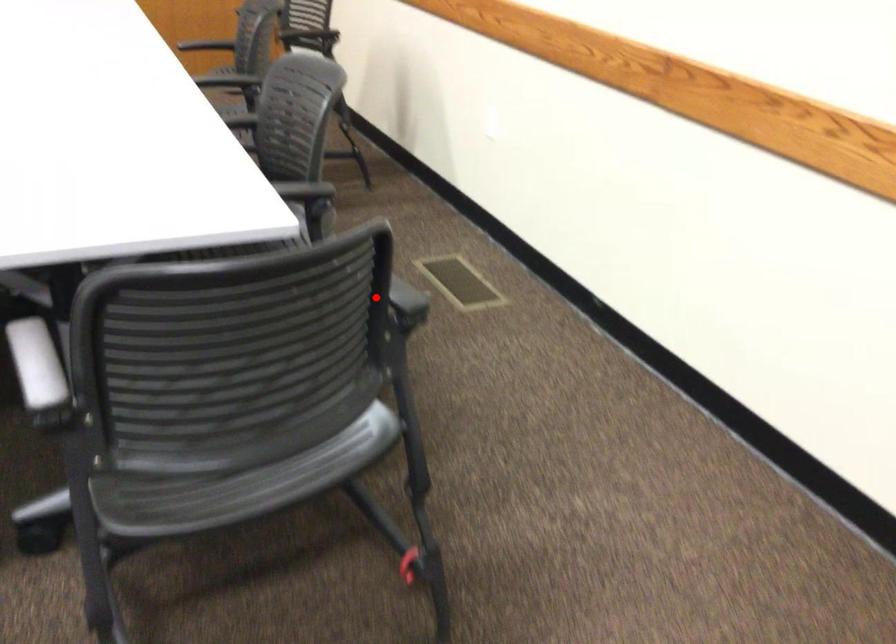
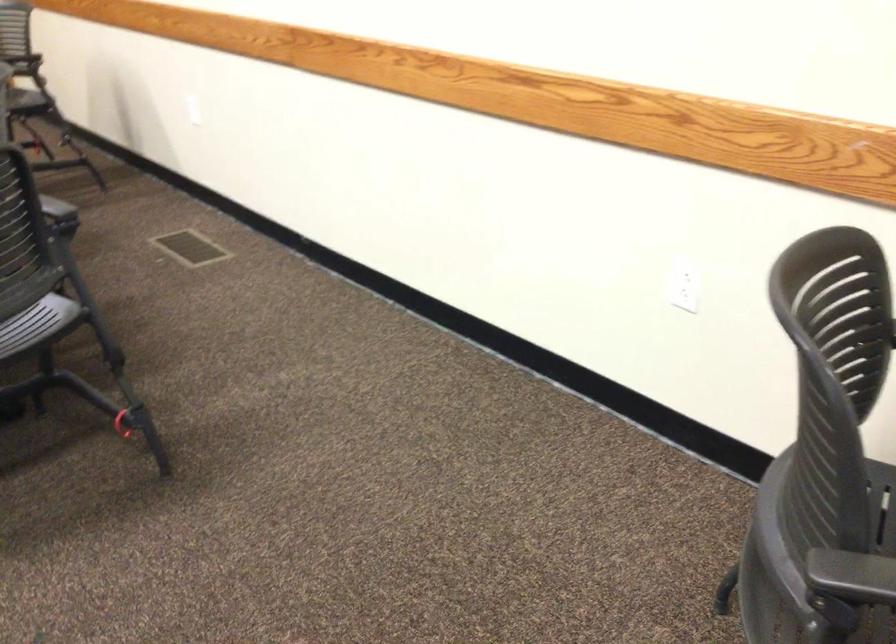
Where in the second image is the point corresponding to the highlighted location from the first image?

(56, 207)